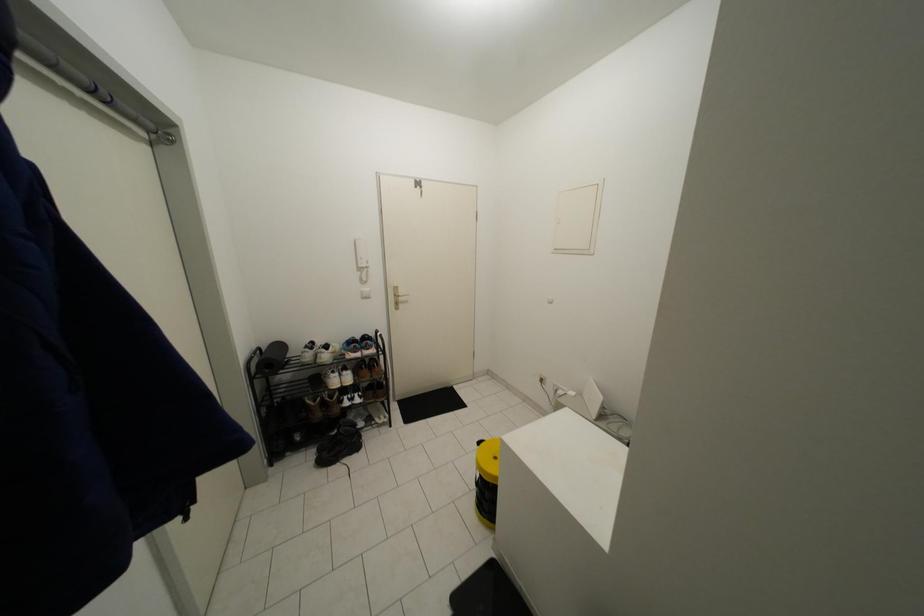
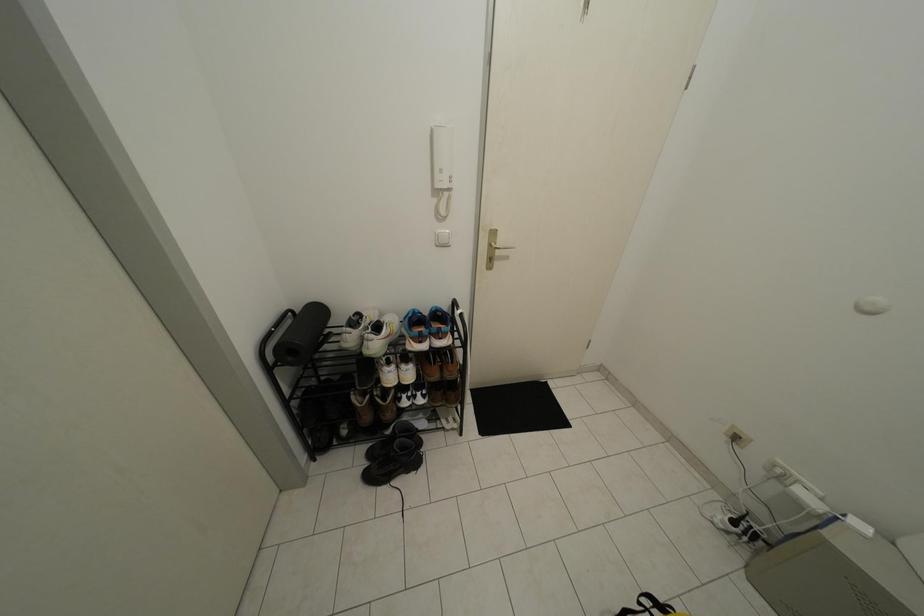
Question: Based on the continuous images, in which direction is the camera rotating? Reply with the corresponding letter.

Choices:
 (A) Left
 (B) Right
 (C) Up
 (D) Down

Answer: (D)